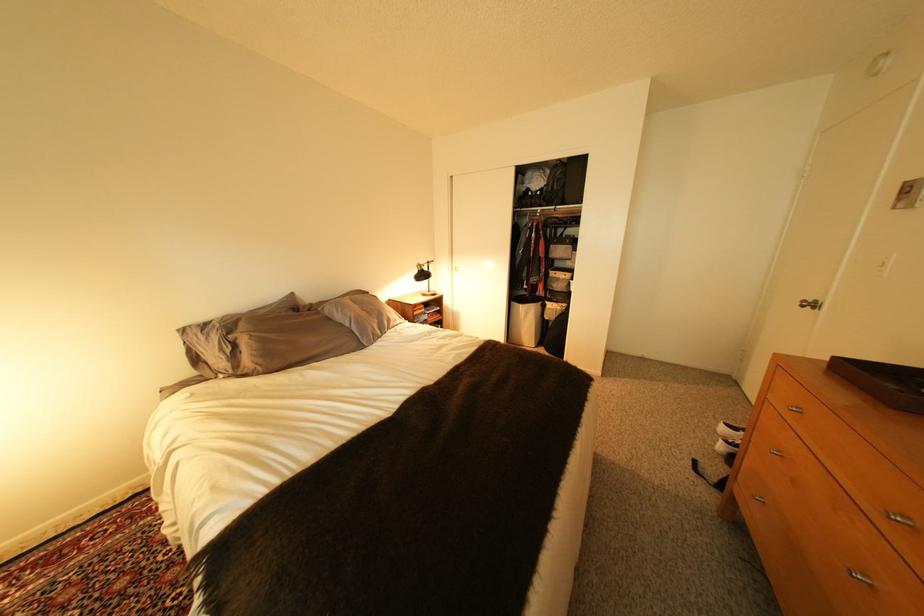
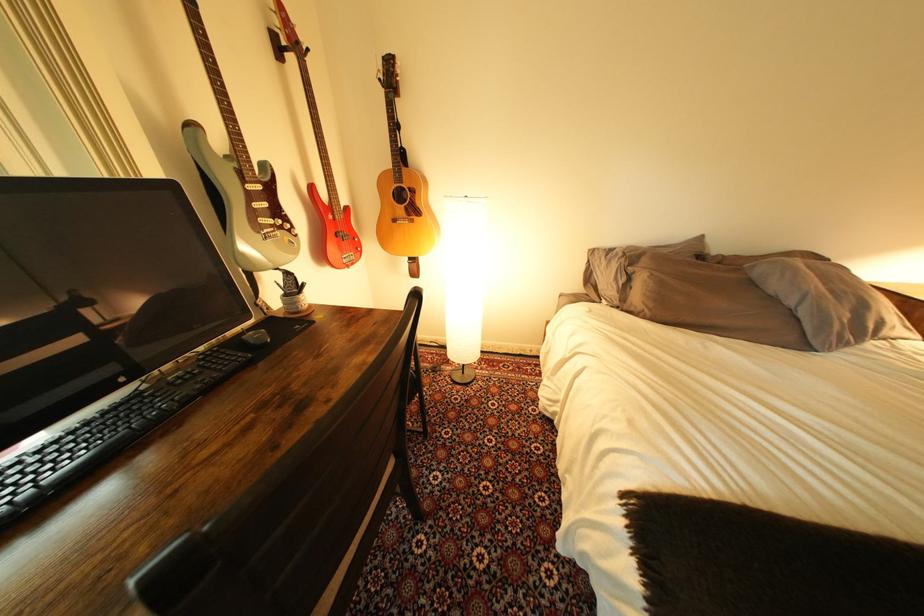
Where in the second image is the point corresponding to point 335,310 from the first image?

(767, 268)